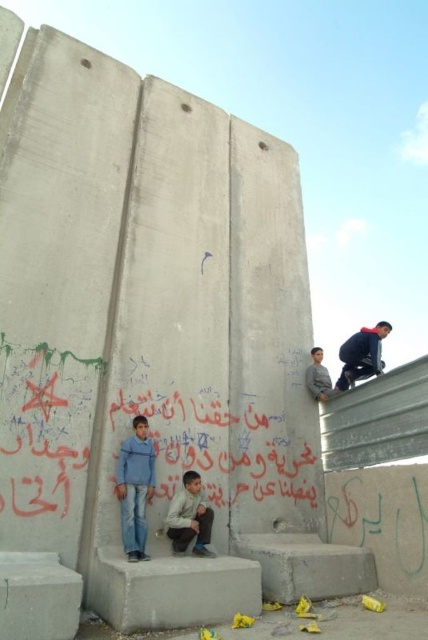
Question: Estimate the real-world distances between objects in this image. Which object is farther from the gray fabric jacket at upper right?

Choices:
 (A) concreteroughconcrete block at lower center
 (B) dark blue fabric jacket at upper right

Answer: (A)

Question: Is concreteroughconcrete block at lower center above gray concrete block at lower left?

Choices:
 (A) no
 (B) yes

Answer: (A)

Question: Does gray concrete block at lower left have a smaller size compared to blue jeans at lower left?

Choices:
 (A) no
 (B) yes

Answer: (A)

Question: Which is farther from the dark blue fabric jacket at upper right?

Choices:
 (A) gray concrete block at lower left
 (B) blue jeans at lower left

Answer: (A)

Question: Can you confirm if blue jeans at lower left is positioned above light brown fabric pants at lower center?

Choices:
 (A) no
 (B) yes

Answer: (B)

Question: Which point is farther from the camera taking this photo?

Choices:
 (A) (127, 470)
 (B) (190, 488)
 (C) (362, 330)
 (D) (318, 381)

Answer: (C)